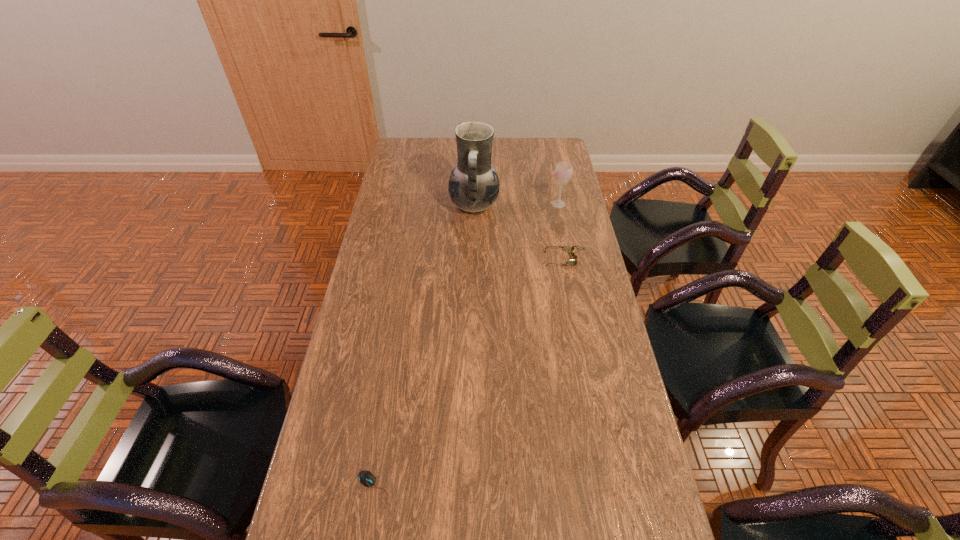
Where is `pitcher`? The image size is (960, 540). pitcher is located at coordinates (473, 186).

Locate an element on the screen. This screenshot has height=540, width=960. the second object from left to right is located at coordinates (473, 186).

Find the location of `the second tallest object`. the second tallest object is located at coordinates (563, 171).

The width and height of the screenshot is (960, 540). Find the location of `spectacles`. spectacles is located at coordinates (567, 249).

Find the location of `the second nearest object`. the second nearest object is located at coordinates (567, 249).

The image size is (960, 540). In order to click on the shortest object in this screenshot , I will do `click(366, 478)`.

Image resolution: width=960 pixels, height=540 pixels. I want to click on the leftmost object, so click(x=366, y=478).

Find the location of a particular element. The width and height of the screenshot is (960, 540). free point located on the front-facing side of the pitcher is located at coordinates (572, 206).

At what (x,y) coordinates should I click in order to perform the action: click on vacant space located 0.230m on the left of the second tallest object. Please return your answer as a coordinate pair (x, y). Looking at the image, I should click on (493, 204).

What are the coordinates of `free space located 0.280m on the front-facing side of the third farthest object` in the screenshot? It's located at (467, 259).